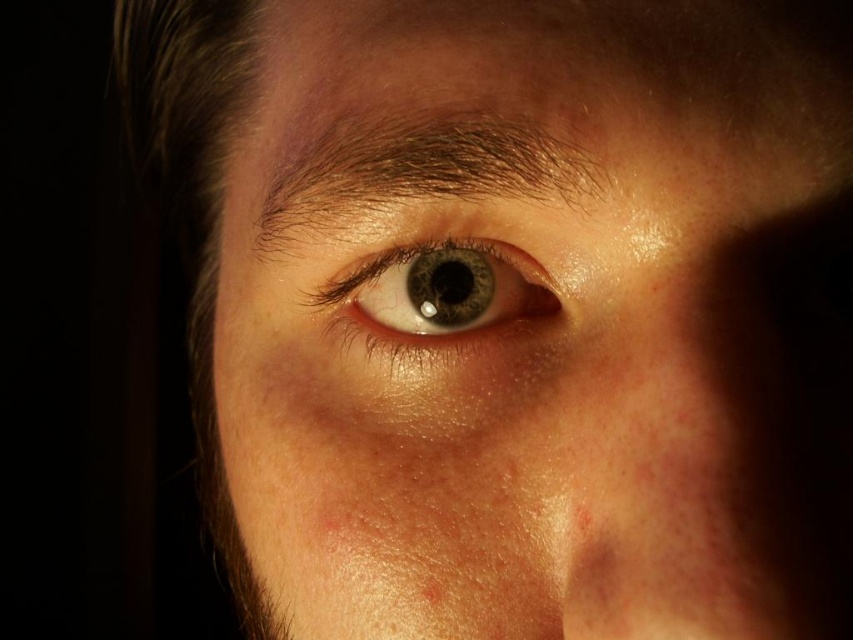
Looking at the closeup of the face, which object is positioned to the right of the other between the smooth skin eye at center and the shiny blue eye at center?

The smooth skin eye at center is positioned to the right of the shiny blue eye at center.

Based on the scene description, which object is taller between the smooth skin eye at center and the brown matte freckle at lower center?

The smooth skin eye at center is taller than the brown matte freckle at lower center.

You are a makeup artist preparing to apply concealer on the brown matte freckle at lower center. You have a small brush that is 3 centimeters wide. Can you reach the freckle without accidentally touching the shiny blue eye at center with the brush?

The shiny blue eye at center and brown matte freckle at lower center are 6.66 centimeters apart. Since the brush is only 3 centimeters wide, there is enough space between them to apply concealer on the brown matte freckle at lower center without touching the shiny blue eye at center.